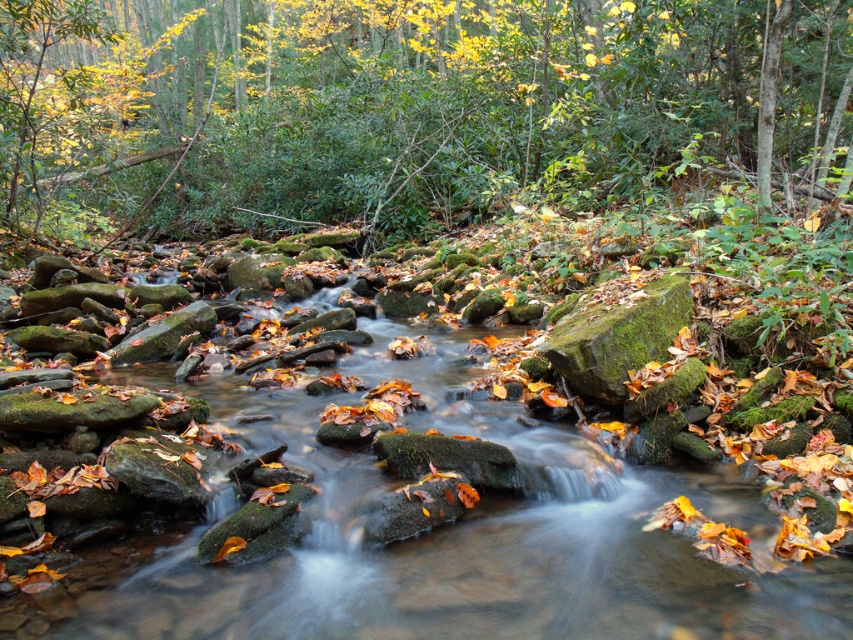
In the scene shown: You are standing at the edge of the stream in the forest scene. There is a point marked at coordinates (405,484). What is located at that point?

The point at coordinates (405,484) marks green mossy rocks at center.

Based on the scene, which object takes up more area in the image between the green mossy rocks at center and the green leafy tree at upper center?

The green leafy tree at upper center occupies more space than the green mossy rocks at center.